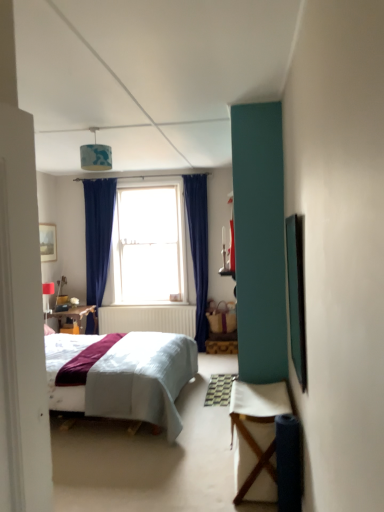
Question: Is blue fabric lampshade at upper center, the first lamp from the top, further to the viewer compared to white fabric table at lower right?

Choices:
 (A) yes
 (B) no

Answer: (A)

Question: Can you confirm if blue fabric lampshade at upper center, positioned as the 1th lamp in right-to-left order, is shorter than white fabric table at lower right?

Choices:
 (A) yes
 (B) no

Answer: (A)

Question: Does blue fabric lampshade at upper center, positioned as the 1th lamp in right-to-left order, contain white fabric table at lower right?

Choices:
 (A) no
 (B) yes

Answer: (A)

Question: Can you confirm if blue fabric lampshade at upper center, positioned as the 1th lamp in right-to-left order, is wider than white fabric table at lower right?

Choices:
 (A) yes
 (B) no

Answer: (B)

Question: Is blue fabric lampshade at upper center, positioned as the 1th lamp in right-to-left order, positioned with its back to white fabric table at lower right?

Choices:
 (A) yes
 (B) no

Answer: (B)

Question: Can you confirm if blue fabric lampshade at upper center, the first lamp from the top, is smaller than white fabric table at lower right?

Choices:
 (A) yes
 (B) no

Answer: (A)

Question: Could you tell me if blue fabric lampshade at upper center, positioned as the 1th lamp in right-to-left order, is turned towards clear glass window at center?

Choices:
 (A) yes
 (B) no

Answer: (B)

Question: Can you confirm if blue fabric lampshade at upper center, acting as the second lamp starting from the left, is taller than clear glass window at center?

Choices:
 (A) no
 (B) yes

Answer: (A)

Question: Is blue fabric lampshade at upper center, acting as the second lamp starting from the back, surrounding clear glass window at center?

Choices:
 (A) yes
 (B) no

Answer: (B)

Question: Considering the relative sizes of blue fabric lampshade at upper center, acting as the second lamp starting from the left, and clear glass window at center in the image provided, is blue fabric lampshade at upper center, acting as the second lamp starting from the left, shorter than clear glass window at center?

Choices:
 (A) yes
 (B) no

Answer: (A)

Question: Does blue fabric lampshade at upper center, the first lamp from the top, lie behind clear glass window at center?

Choices:
 (A) yes
 (B) no

Answer: (B)

Question: From the image's perspective, is blue fabric lampshade at upper center, positioned as the 1th lamp in right-to-left order, on clear glass window at center?

Choices:
 (A) yes
 (B) no

Answer: (A)

Question: Is clear glass window at center thinner than matte white lampshade at upper left, the first lamp positioned from the back?

Choices:
 (A) no
 (B) yes

Answer: (A)